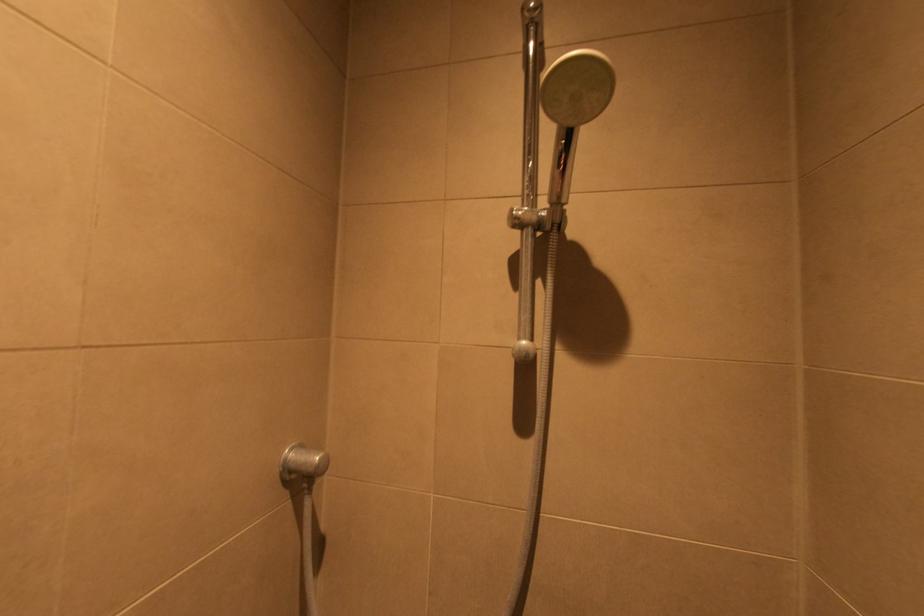
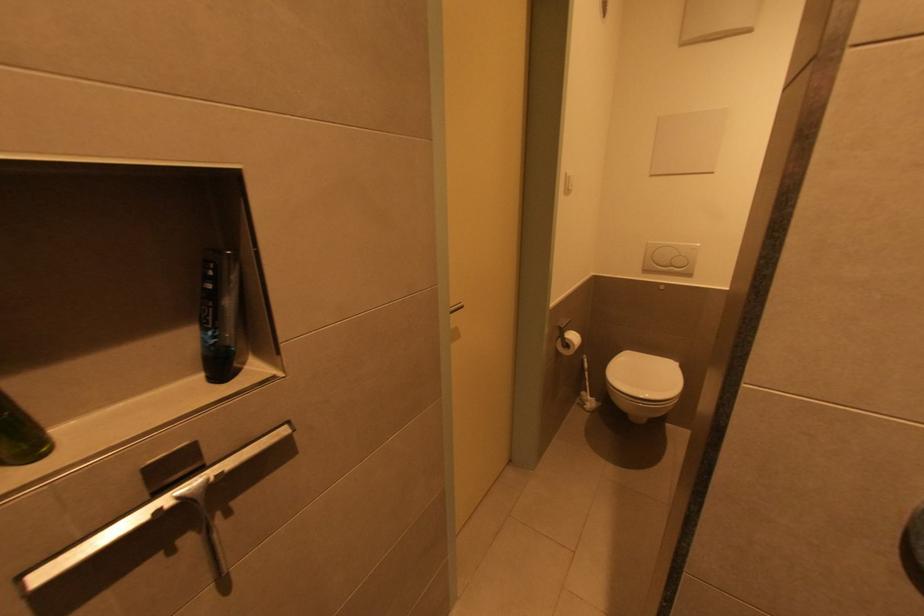
The first image is from the beginning of the video and the second image is from the end. How did the camera likely rotate when shooting the video?

The camera's rotation is toward left-down.